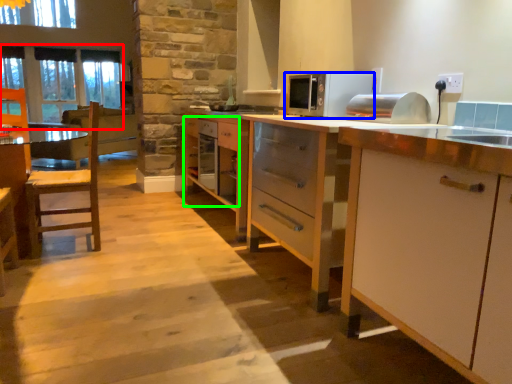
Question: Which is nearer to the window screen (highlighted by a red box)? microwave oven (highlighted by a blue box) or drawer (highlighted by a green box).

Choices:
 (A) microwave oven
 (B) drawer

Answer: (B)